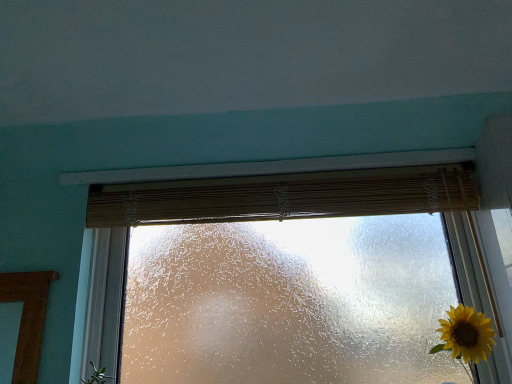
Question: In the image, is teal matte wall at upper center on the left side or the right side of bamboo curtain at center?

Choices:
 (A) left
 (B) right

Answer: (A)

Question: Is teal matte wall at upper center inside or outside of bamboo curtain at center?

Choices:
 (A) inside
 (B) outside

Answer: (B)

Question: Which of these objects is positioned farthest from the teal matte wall at upper center?

Choices:
 (A) frosted glass window at center
 (B) bamboo curtain at center

Answer: (B)

Question: Estimate the real-world distances between objects in this image. Which object is closer to the teal matte wall at upper center?

Choices:
 (A) frosted glass window at center
 (B) bamboo curtain at center

Answer: (A)